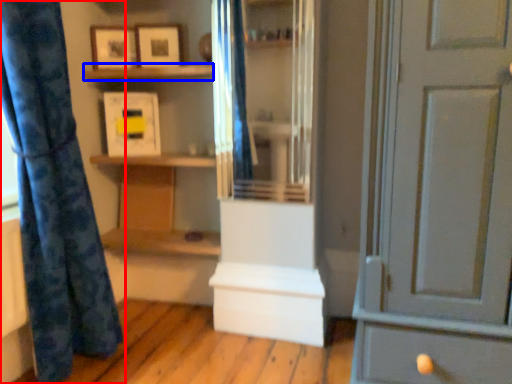
Question: Which point is further to the camera, curtain (highlighted by a red box) or shelf (highlighted by a blue box)?

Choices:
 (A) curtain
 (B) shelf

Answer: (B)